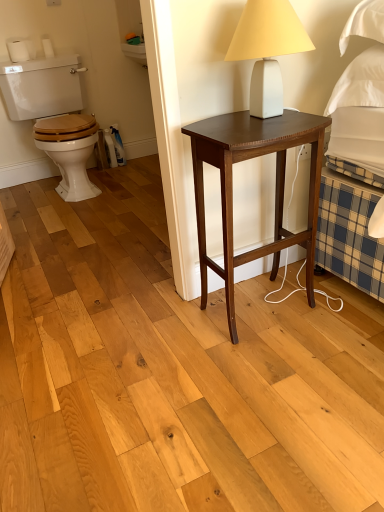
In order to face dark wood nightstand at center, should I rotate leftwards or rightwards?

You should look right and rotate roughly 8.625 degrees.

In order to click on white matte table lamp at upper right in this screenshot , I will do `click(267, 50)`.

What's the angular difference between dark wood nightstand at center and white matte table lamp at upper right's facing directions?

The facing directions of dark wood nightstand at center and white matte table lamp at upper right are 2.85 degrees apart.

From the image's perspective, which one is positioned lower, dark wood nightstand at center or white matte table lamp at upper right?

dark wood nightstand at center appears lower in the image.

This screenshot has height=512, width=384. What are the coordinates of `table lamp in front of the dark wood nightstand at center` in the screenshot? It's located at (267, 50).

From a real-world perspective, is dark wood nightstand at center physically below white matte table lamp at upper right?

Yes, from a real-world perspective, dark wood nightstand at center is beneath white matte table lamp at upper right.

Does point (271, 38) come farther from viewer compared to point (241, 154)?

No, it is not.

Measure the distance between white matte table lamp at upper right and dark wood nightstand at center.

The distance of white matte table lamp at upper right from dark wood nightstand at center is 9.72 inches.

How many degrees apart are the facing directions of white matte table lamp at upper right and dark wood nightstand at center?

The angle between the facing direction of white matte table lamp at upper right and the facing direction of dark wood nightstand at center is 2.85 degrees.

From the image's perspective, which one is positioned higher, white matte table lamp at upper right or dark wood nightstand at center?

white matte table lamp at upper right.

What's the angular difference between wooden at left and white matte table lamp at upper right's facing directions?

The angular difference between wooden at left and white matte table lamp at upper right is 3.3 degrees.

Does wooden at left turn towards white matte table lamp at upper right?

Yes, wooden at left is aimed at white matte table lamp at upper right.

Is point (70, 117) less distant than point (235, 53)?

No, it is not.

Do you think wooden at left is within white matte table lamp at upper right, or outside of it?

wooden at left is located beyond the bounds of white matte table lamp at upper right.

The image size is (384, 512). I want to click on sit above the dark wood nightstand at center (from a real-world perspective), so click(54, 117).

From the image's perspective, which is above, wooden at left or dark wood nightstand at center?

From the image's view, wooden at left is above.

Is dark wood nightstand at center at the back of wooden at left?

No, wooden at left is not facing the opposite direction of dark wood nightstand at center.

Considering the sizes of wooden at left and dark wood nightstand at center in the image, is wooden at left bigger or smaller than dark wood nightstand at center?

wooden at left is bigger than dark wood nightstand at center.

Is dark wood nightstand at center positioned before wooden at left?

Yes, it is.

Find the location of a particular element. This screenshot has width=384, height=512. nightstand in front of the wooden at left is located at coordinates (275, 187).

Is dark wood nightstand at center looking in the opposite direction of wooden at left?

Yes, wooden at left is at the back of dark wood nightstand at center.

Which is in front, point (237, 161) or point (26, 86)?

The point (237, 161) is more forward.

Where is `table lamp on the right of wooden at left`? This screenshot has height=512, width=384. table lamp on the right of wooden at left is located at coordinates coord(267,50).

From a real-world perspective, relative to wooden at left, is white matte table lamp at upper right vertically above or below?

Clearly, from a real-world perspective, white matte table lamp at upper right is above wooden at left.

Is white matte table lamp at upper right wider than wooden at left?

Incorrect, the width of white matte table lamp at upper right does not surpass that of wooden at left.

Is white matte table lamp at upper right oriented away from wooden at left?

Yes, white matte table lamp at upper right is positioned with its back facing wooden at left.

At what (x,y) coordinates should I click in order to perform the action: click on nightstand directly beneath the white matte table lamp at upper right (from a real-world perspective). Please return your answer as a coordinate pair (x, y). Looking at the image, I should click on (275, 187).

Identify the location of table lamp located on the right of dark wood nightstand at center. The image size is (384, 512). (267, 50).

From the image, which object appears to be nearer to white matte table lamp at upper right, dark wood nightstand at center or wooden at left?

dark wood nightstand at center lies closer to white matte table lamp at upper right than the other object.

Looking at the image, which one is located closer to wooden at left, white matte table lamp at upper right or dark wood nightstand at center?

dark wood nightstand at center.

Estimate the real-world distances between objects in this image. Which object is further from dark wood nightstand at center, white matte table lamp at upper right or wooden at left?

Based on the image, wooden at left appears to be further to dark wood nightstand at center.

When comparing their distances from dark wood nightstand at center, does wooden at left or white matte table lamp at upper right seem further?

Based on the image, wooden at left appears to be further to dark wood nightstand at center.

From the image, which object appears to be nearer to white matte table lamp at upper right, wooden at left or dark wood nightstand at center?

dark wood nightstand at center.

Which object lies further to the anchor point wooden at left, dark wood nightstand at center or white matte table lamp at upper right?

The object further to wooden at left is white matte table lamp at upper right.

At what (x,y) coordinates should I click in order to perform the action: click on nightstand positioned between white matte table lamp at upper right and wooden at left from near to far. Please return your answer as a coordinate pair (x, y). This screenshot has width=384, height=512. Looking at the image, I should click on (275, 187).